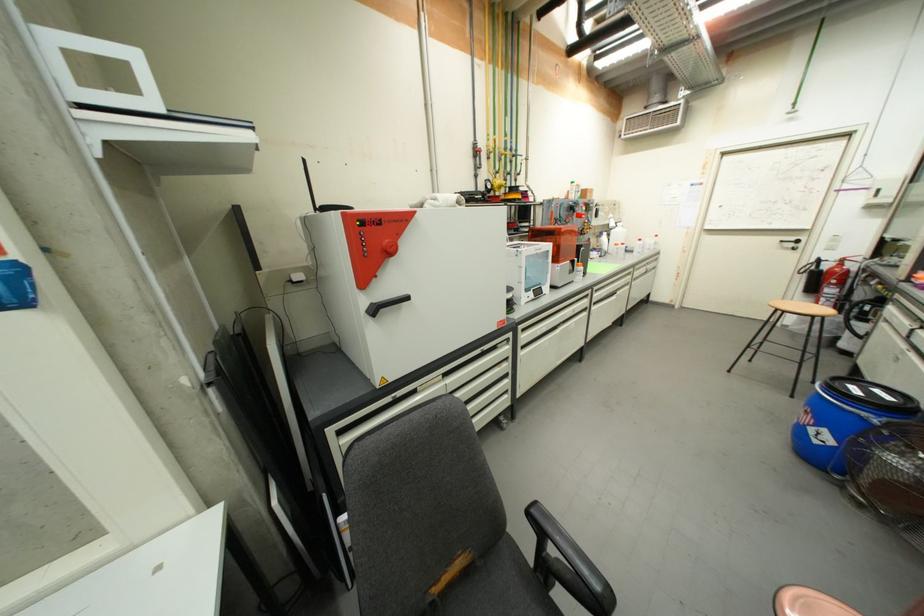
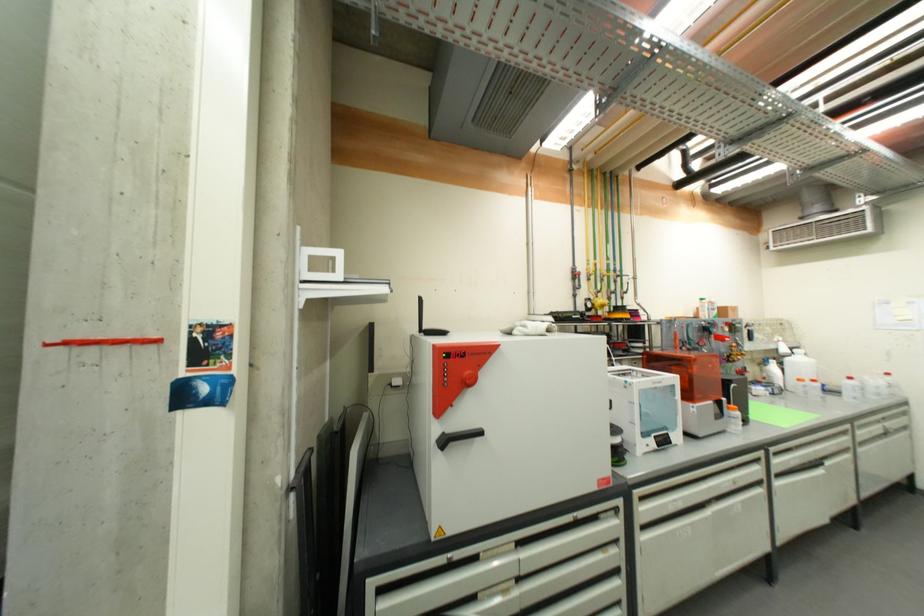
The point at (396, 249) is marked in the first image. Where is the corresponding point in the second image?

(476, 381)